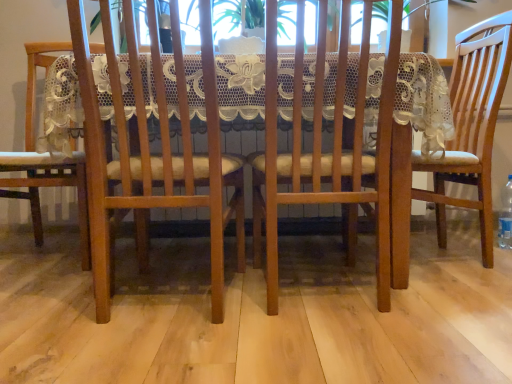
Question: Is matte wood chair at left, the fourth chair viewed from the right, to the left of clear plastic bottle at lower right from the viewer's perspective?

Choices:
 (A) yes
 (B) no

Answer: (A)

Question: Considering the relative positions of matte wood chair at left, acting as the first chair starting from the left, and clear plastic bottle at lower right in the image provided, is matte wood chair at left, acting as the first chair starting from the left, in front of clear plastic bottle at lower right?

Choices:
 (A) no
 (B) yes

Answer: (B)

Question: Does matte wood chair at left, the fourth chair viewed from the right, have a lesser width compared to clear plastic bottle at lower right?

Choices:
 (A) yes
 (B) no

Answer: (B)

Question: Can you confirm if matte wood chair at left, acting as the first chair starting from the left, is smaller than clear plastic bottle at lower right?

Choices:
 (A) yes
 (B) no

Answer: (B)

Question: From a real-world perspective, does matte wood chair at left, the fourth chair viewed from the right, stand above clear plastic bottle at lower right?

Choices:
 (A) yes
 (B) no

Answer: (A)

Question: Considering the positions of wooden chair at center, which ranks as the second chair in right-to-left order, and matte wood chair at right, which appears as the 4th chair when viewed from the left, in the image, is wooden chair at center, which ranks as the second chair in right-to-left order, bigger or smaller than matte wood chair at right, which appears as the 4th chair when viewed from the left,?

Choices:
 (A) big
 (B) small

Answer: (B)

Question: From a real-world perspective, is wooden chair at center, marked as the third chair in a left-to-right arrangement, positioned above or below matte wood chair at right, positioned as the 1th chair in right-to-left order?

Choices:
 (A) above
 (B) below

Answer: (B)

Question: Would you say wooden chair at center, which ranks as the second chair in right-to-left order, is inside or outside matte wood chair at right, which appears as the 4th chair when viewed from the left?

Choices:
 (A) outside
 (B) inside

Answer: (A)

Question: Is wooden chair at center, which ranks as the second chair in right-to-left order, wider or thinner than matte wood chair at right, which appears as the 4th chair when viewed from the left?

Choices:
 (A) thin
 (B) wide

Answer: (A)

Question: Considering their positions, is matte wood chair at right, positioned as the 1th chair in right-to-left order, located in front of or behind matte wood chair at left, acting as the first chair starting from the left?

Choices:
 (A) front
 (B) behind

Answer: (A)

Question: Looking at their shapes, would you say matte wood chair at right, positioned as the 1th chair in right-to-left order, is wider or thinner than matte wood chair at left, the fourth chair viewed from the right?

Choices:
 (A) thin
 (B) wide

Answer: (B)

Question: Is point (478, 109) closer or farther from the camera than point (40, 155)?

Choices:
 (A) closer
 (B) farther

Answer: (B)

Question: Is matte wood chair at right, which appears as the 4th chair when viewed from the left, taller or shorter than matte wood chair at left, acting as the first chair starting from the left?

Choices:
 (A) short
 (B) tall

Answer: (A)

Question: In the image, is wooden chair at center, marked as the third chair in a left-to-right arrangement, positioned in front of or behind wooden table at center?

Choices:
 (A) behind
 (B) front

Answer: (B)

Question: Is wooden chair at center, marked as the third chair in a left-to-right arrangement, wider or thinner than wooden table at center?

Choices:
 (A) thin
 (B) wide

Answer: (A)